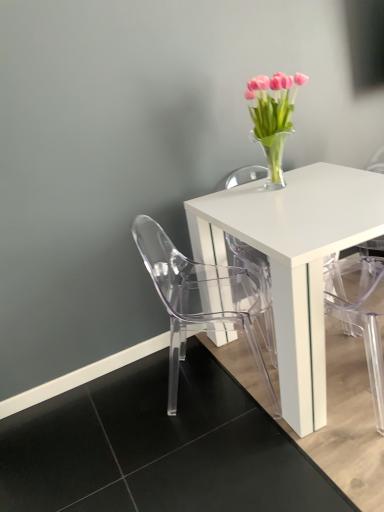
Where is `free point in front of pink glass vase at upper right`? free point in front of pink glass vase at upper right is located at coordinates (286, 196).